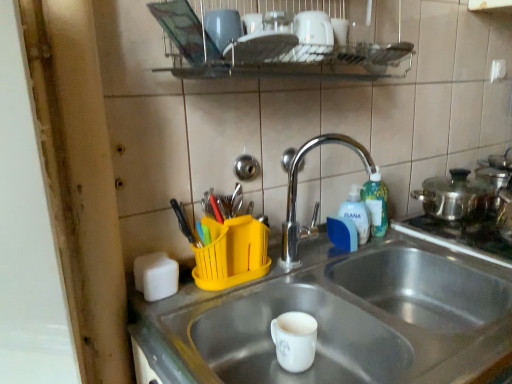
Question: Is the depth of yellow plastic utensil holder at upper center less than that of chrome/metallic faucet at center?

Choices:
 (A) yes
 (B) no

Answer: (A)

Question: Considering the relative sizes of yellow plastic utensil holder at upper center and chrome/metallic faucet at center in the image provided, is yellow plastic utensil holder at upper center bigger than chrome/metallic faucet at center?

Choices:
 (A) no
 (B) yes

Answer: (A)

Question: Can we say yellow plastic utensil holder at upper center lies outside chrome/metallic faucet at center?

Choices:
 (A) yes
 (B) no

Answer: (A)

Question: Is yellow plastic utensil holder at upper center oriented away from chrome/metallic faucet at center?

Choices:
 (A) yes
 (B) no

Answer: (B)

Question: From the image's perspective, does yellow plastic utensil holder at upper center appear lower than chrome/metallic faucet at center?

Choices:
 (A) yes
 (B) no

Answer: (A)

Question: From the image's perspective, relative to white glossy mug at center, is chrome/metallic faucet at center above or below?

Choices:
 (A) above
 (B) below

Answer: (A)

Question: Is chrome/metallic faucet at center to the left or to the right of white glossy mug at center in the image?

Choices:
 (A) left
 (B) right

Answer: (B)

Question: Is chrome/metallic faucet at center taller or shorter than white glossy mug at center?

Choices:
 (A) short
 (B) tall

Answer: (B)

Question: Which is correct: chrome/metallic faucet at center is inside white glossy mug at center, or outside of it?

Choices:
 (A) inside
 (B) outside

Answer: (B)

Question: Looking at the image, does blue plastic bottle at upper right, marked as the 1th bottle in a left-to-right arrangement, seem bigger or smaller compared to chrome/metallic faucet at center?

Choices:
 (A) small
 (B) big

Answer: (A)

Question: Is blue plastic bottle at upper right, which appears as the 2th bottle when viewed from the right, to the left or to the right of chrome/metallic faucet at center in the image?

Choices:
 (A) right
 (B) left

Answer: (A)

Question: Is blue plastic bottle at upper right, which appears as the 2th bottle when viewed from the right, taller or shorter than chrome/metallic faucet at center?

Choices:
 (A) short
 (B) tall

Answer: (A)

Question: Is blue plastic bottle at upper right, which appears as the 2th bottle when viewed from the right, wider or thinner than chrome/metallic faucet at center?

Choices:
 (A) wide
 (B) thin

Answer: (B)

Question: Considering the positions of yellow plastic utensil holder at upper center and silver metallic sink at center in the image, is yellow plastic utensil holder at upper center taller or shorter than silver metallic sink at center?

Choices:
 (A) short
 (B) tall

Answer: (A)

Question: Is yellow plastic utensil holder at upper center situated inside silver metallic sink at center or outside?

Choices:
 (A) outside
 (B) inside

Answer: (A)